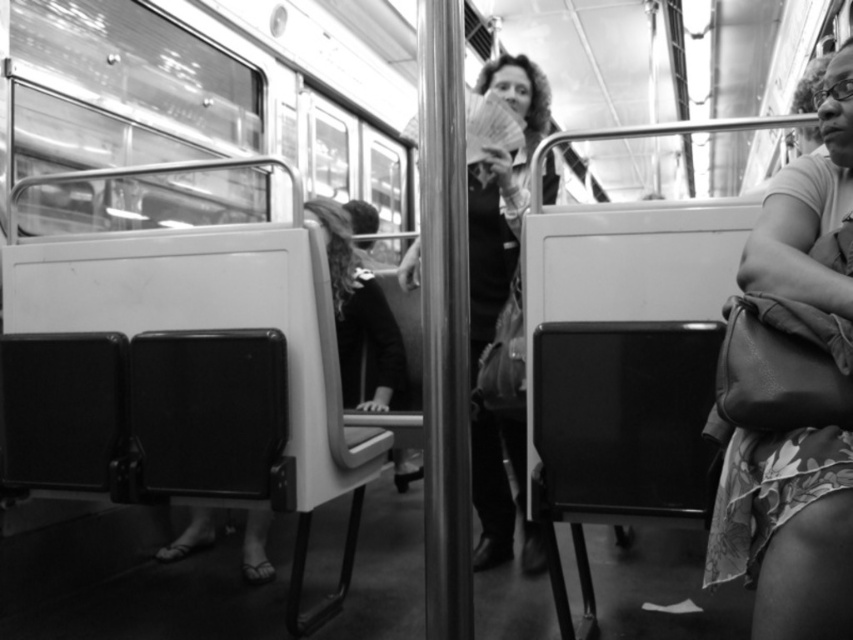
You are a passenger on the subway and need to retrieve your items. You have a leather handbag at right and a matte black jacket at center. Which item is easier to reach without moving from your seat?

The leather handbag at right is closer to the viewer than the matte black jacket at center, so it is easier to reach without moving from your seat.